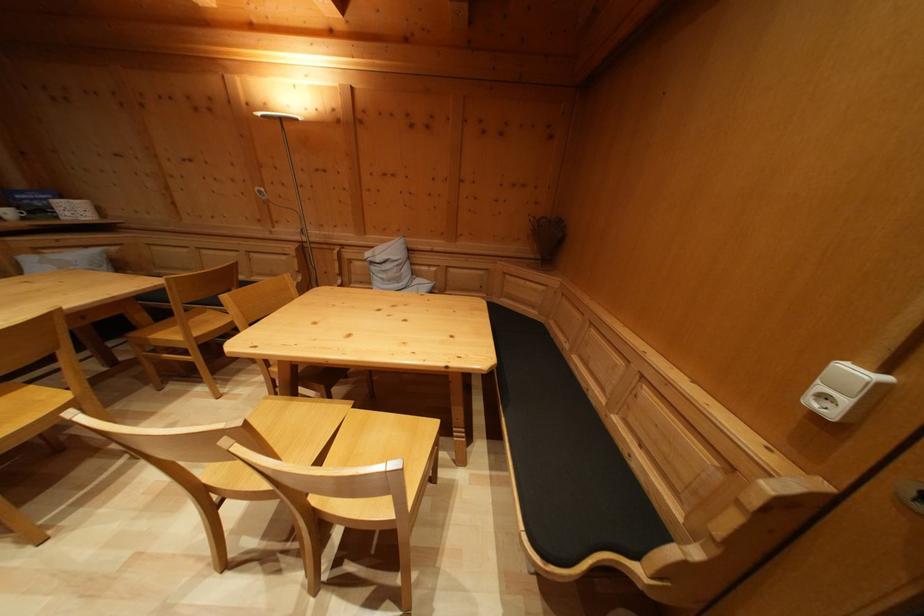
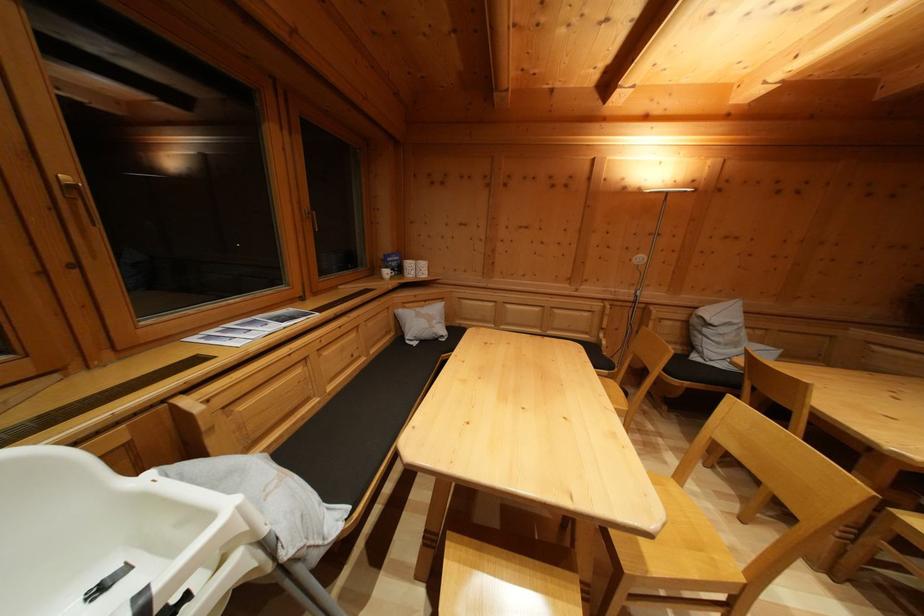
Locate, in the second image, the point that corresponds to point (379, 275) in the first image.

(711, 337)